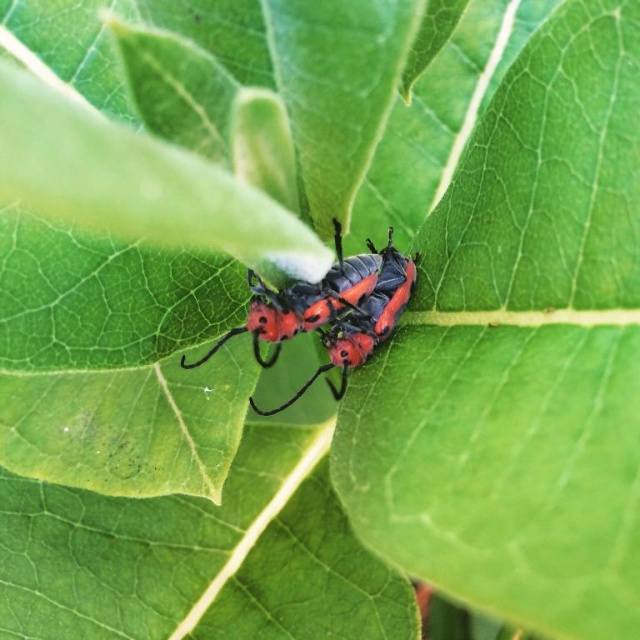
Is point (340, 492) positioned behind point (337, 296)?

No, (340, 492) is closer to viewer.

The width and height of the screenshot is (640, 640). Identify the location of green matte leaf at center. (520, 353).